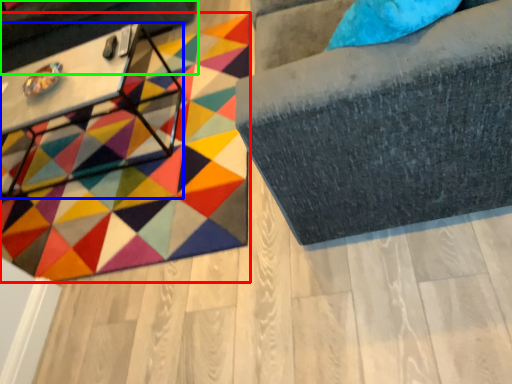
Question: Estimate the real-world distances between objects in this image. Which object is farther from mat (highlighted by a red box), table (highlighted by a blue box) or swivel chair (highlighted by a green box)?

Choices:
 (A) table
 (B) swivel chair

Answer: (B)